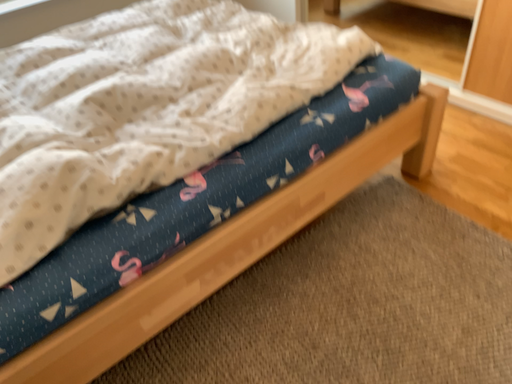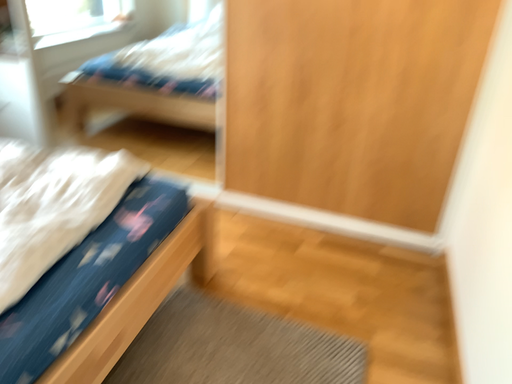
Question: Which way did the camera rotate in the video?

Choices:
 (A) rotated right
 (B) rotated left

Answer: (A)